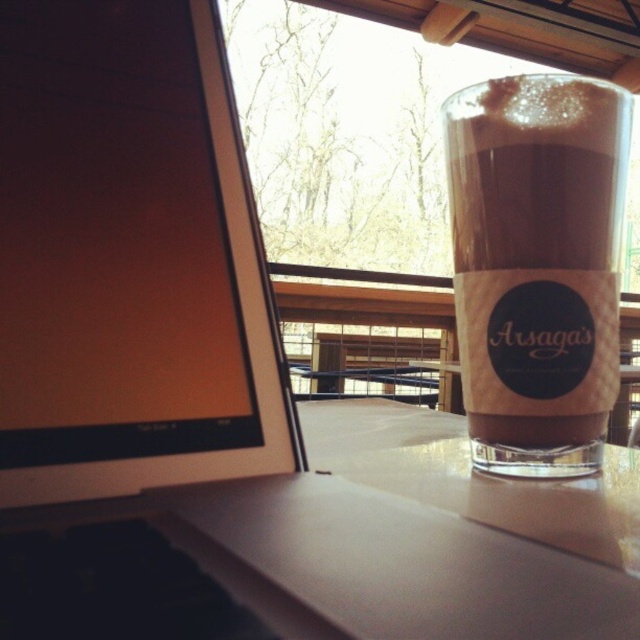
Question: Is matte black monitor at left below brown frothy beverage at right?

Choices:
 (A) yes
 (B) no

Answer: (B)

Question: Can you confirm if matte black monitor at left is bigger than brown frothy beverage at right?

Choices:
 (A) yes
 (B) no

Answer: (A)

Question: Among these objects, which one is nearest to the camera?

Choices:
 (A) matte black monitor at left
 (B) brown frothy beverage at right

Answer: (A)

Question: Among these objects, which one is nearest to the camera?

Choices:
 (A) brown frothy beverage at right
 (B) matte black monitor at left

Answer: (B)

Question: Which point appears closest to the camera in this image?

Choices:
 (A) (476, 369)
 (B) (109, 177)

Answer: (B)

Question: From the image, what is the correct spatial relationship of matte black monitor at left in relation to brown frothy beverage at right?

Choices:
 (A) right
 (B) left

Answer: (B)